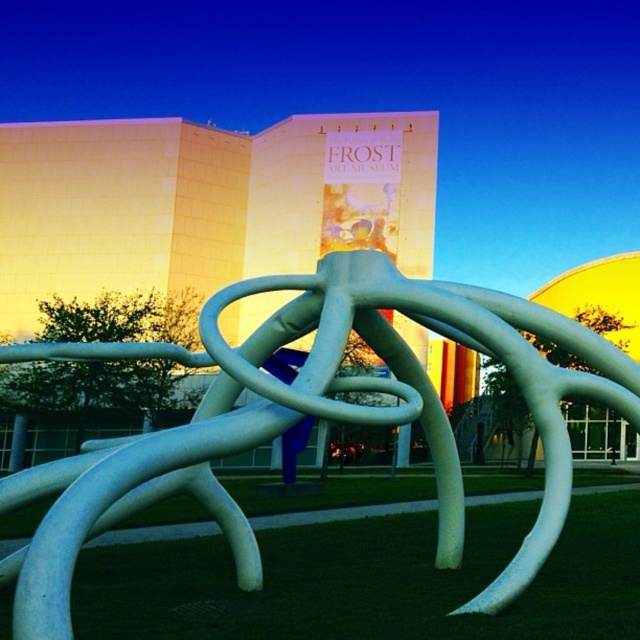
Who is more forward, (348,280) or (621,573)?

Point (348,280)

Does white glossy sculpture at center appear over green grass at lower center?

Correct, white glossy sculpture at center is located above green grass at lower center.

Who is more forward, (262, 337) or (173, 612)?

Point (173, 612) is more forward.

You are a GUI agent. You are given a task and a screenshot of the screen. Output one action in this format:
    pyautogui.click(x=<x>, y=<y>)
    Task: Click on the white glossy sculpture at center
    
    Given the screenshot: What is the action you would take?
    pyautogui.click(x=310, y=413)